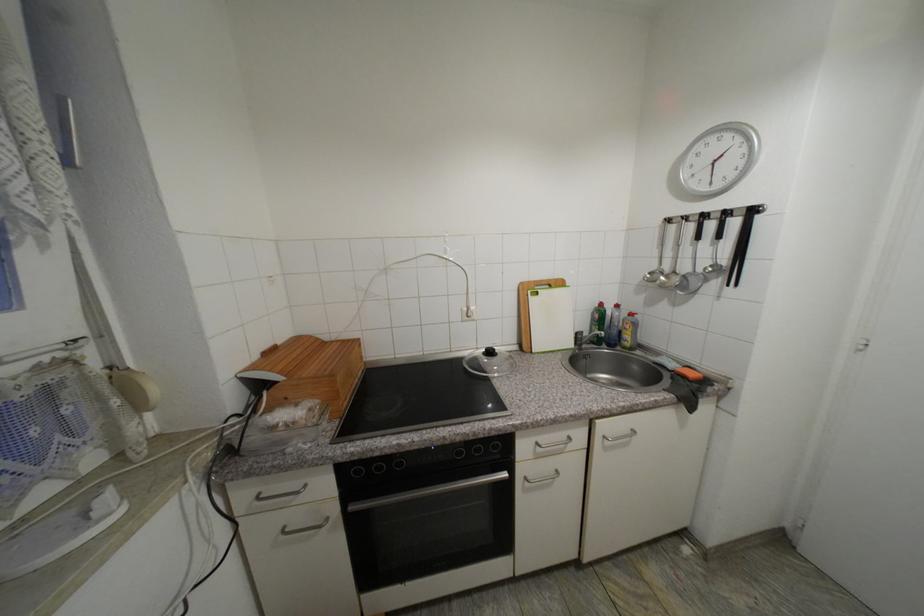
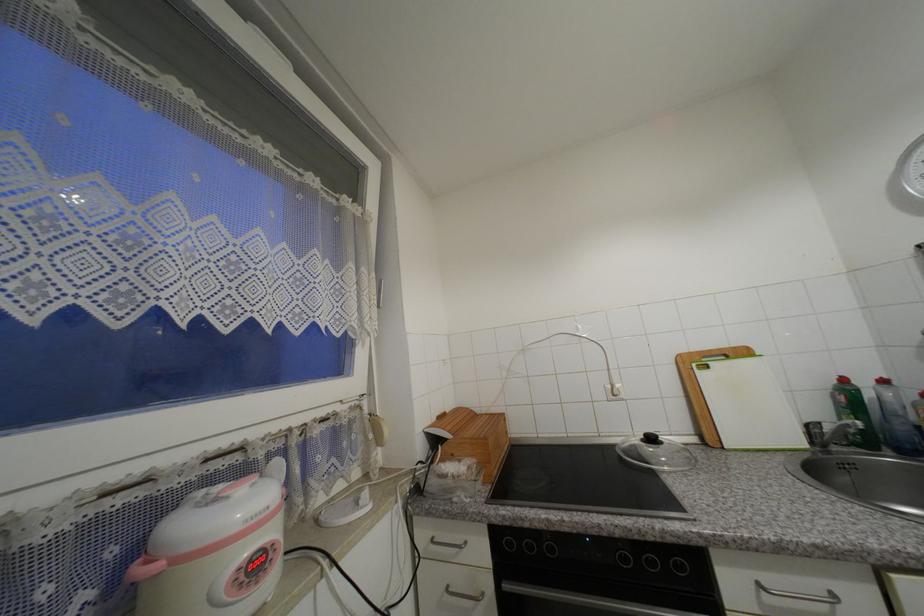
Where in the second image is the point corresponding to point 565,285 from the first image?

(749, 354)